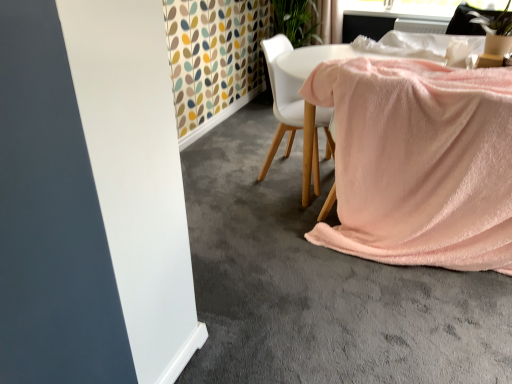
Identify the location of free region under green leafy plant at upper right (from a real-world perspective). (494, 56).